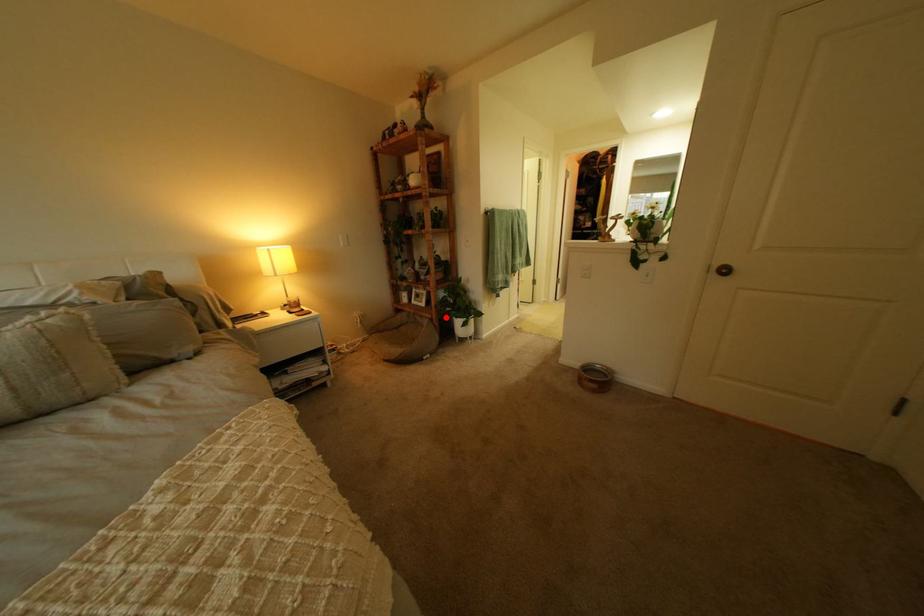
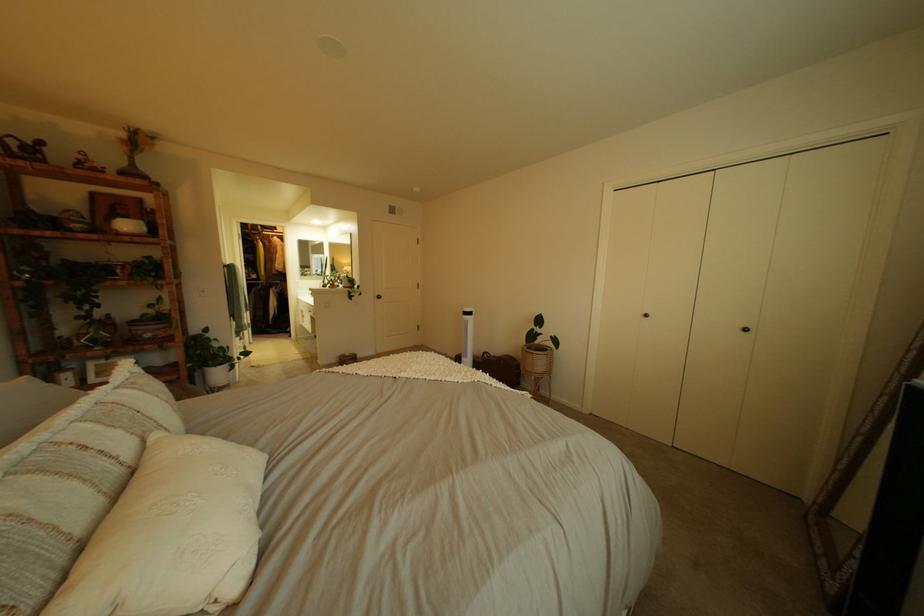
Question: I am providing you with two images of the same scene from different viewpoints. A red point is shown in image1. For the corresponding object point in image2, is it positioned nearer or farther from the camera?

Choices:
 (A) Nearer
 (B) Farther

Answer: (A)